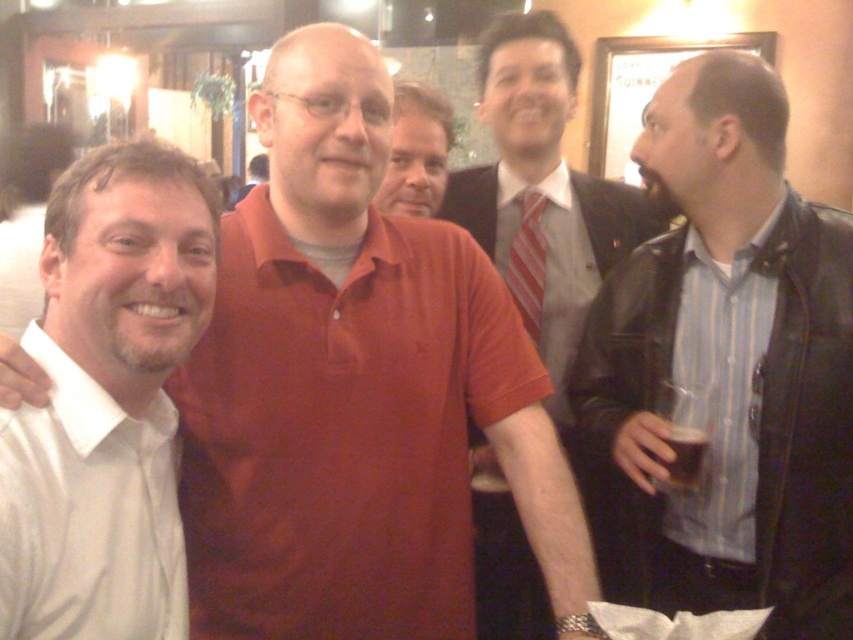
Who is more forward, [169,544] or [693,253]?

Answer: Point [169,544]

In the scene shown: Is white satin shirt at left taller than blue striped shirt at right?

No.

Is point (61, 388) farther from viewer compared to point (741, 298)?

No, it is in front of (741, 298).

Locate an element on the screen. This screenshot has height=640, width=853. white satin shirt at left is located at coordinates (88, 513).

Can you confirm if leather jacket at right is positioned to the left of dark brown liquid at right?

No, leather jacket at right is not to the left of dark brown liquid at right.

Between leather jacket at right and dark brown liquid at right, which one appears on the left side from the viewer's perspective?

Positioned to the left is dark brown liquid at right.

Identify the location of leather jacket at right. The width and height of the screenshot is (853, 640). (730, 362).

Does point (183, 412) lie behind point (540, 221)?

That is False.

Measure the distance between matte red polo shirt at center and camera.

matte red polo shirt at center and camera are 3.42 feet apart from each other.

Locate an element on the screen. matte red polo shirt at center is located at coordinates (355, 387).